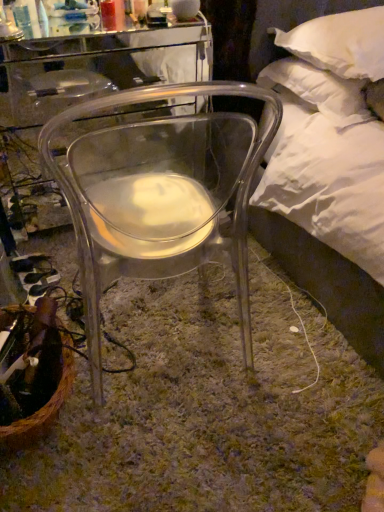
The height and width of the screenshot is (512, 384). What do you see at coordinates (319, 90) in the screenshot?
I see `white soft pillow at upper right, marked as the second pillow in a top-to-bottom arrangement` at bounding box center [319, 90].

Where is `brown woven basket at lower left`? brown woven basket at lower left is located at coordinates (46, 403).

This screenshot has height=512, width=384. What are the coordinates of `transparent plastic chair at center` in the screenshot? It's located at (159, 195).

Consider the image. Is transparent plastic chair at center outside of white soft pillow at upper right, which is the first pillow in bottom-to-top order?

Absolutely, transparent plastic chair at center is external to white soft pillow at upper right, which is the first pillow in bottom-to-top order.

From the image's perspective, is transparent plastic chair at center located above or below white soft pillow at upper right, which is the first pillow in bottom-to-top order?

From the image's perspective, transparent plastic chair at center appears below white soft pillow at upper right, which is the first pillow in bottom-to-top order.

Considering the sizes of objects transparent plastic chair at center and white soft pillow at upper right, which is the first pillow in bottom-to-top order, in the image provided, who is thinner, transparent plastic chair at center or white soft pillow at upper right, which is the first pillow in bottom-to-top order,?

With smaller width is white soft pillow at upper right, which is the first pillow in bottom-to-top order.

In the scene shown: Is transparent plastic chair at center turned away from white soft pillow at upper right, marked as the second pillow in a top-to-bottom arrangement?

No, white soft pillow at upper right, marked as the second pillow in a top-to-bottom arrangement, is not at the back of transparent plastic chair at center.

Can you confirm if white soft pillow at upper right, the first pillow positioned from the top, is positioned to the right of transparent plastic chair at center?

Indeed, white soft pillow at upper right, the first pillow positioned from the top, is positioned on the right side of transparent plastic chair at center.

From the picture: Is white soft pillow at upper right, arranged as the second pillow when ordered from the bottom, in contact with transparent plastic chair at center?

They are not placed beside each other.

Which is behind, point (344, 68) or point (182, 262)?

The point (344, 68) is farther.

Which is correct: white soft pillow at upper right, arranged as the second pillow when ordered from the bottom, is inside transparent plastic chair at center, or outside of it?

white soft pillow at upper right, arranged as the second pillow when ordered from the bottom, is spatially situated outside transparent plastic chair at center.

Which object is closer to the camera, white soft pillow at upper right, which is the first pillow in bottom-to-top order, or brown woven basket at lower left?

brown woven basket at lower left is in front.

Is white soft pillow at upper right, marked as the second pillow in a top-to-bottom arrangement, facing away from brown woven basket at lower left?

That's not correct — white soft pillow at upper right, marked as the second pillow in a top-to-bottom arrangement, is not looking away from brown woven basket at lower left.

Does white soft pillow at upper right, which is the first pillow in bottom-to-top order, touch brown woven basket at lower left?

white soft pillow at upper right, which is the first pillow in bottom-to-top order, and brown woven basket at lower left are clearly separated.

From the image's perspective, which pillow is the 1st one above the brown woven basket at lower left? Please provide its 2D coordinates.

[(319, 90)]

Does point (323, 23) lie behind point (367, 113)?

Yes, point (323, 23) is behind point (367, 113).

Can we say white soft pillow at upper right, arranged as the second pillow when ordered from the bottom, lies outside white soft pillow at upper right, marked as the second pillow in a top-to-bottom arrangement?

Indeed, white soft pillow at upper right, arranged as the second pillow when ordered from the bottom, is completely outside white soft pillow at upper right, marked as the second pillow in a top-to-bottom arrangement.

Is white soft pillow at upper right, arranged as the second pillow when ordered from the bottom, beside white soft pillow at upper right, marked as the second pillow in a top-to-bottom arrangement?

Indeed, white soft pillow at upper right, arranged as the second pillow when ordered from the bottom, and white soft pillow at upper right, marked as the second pillow in a top-to-bottom arrangement, are beside each other and touching.

Does white soft pillow at upper right, which is the first pillow in bottom-to-top order, have a greater height compared to transparent plastic chair at center?

Incorrect, the height of white soft pillow at upper right, which is the first pillow in bottom-to-top order, is not larger of that of transparent plastic chair at center.

Between white soft pillow at upper right, marked as the second pillow in a top-to-bottom arrangement, and transparent plastic chair at center, which one appears on the right side from the viewer's perspective?

Positioned to the right is white soft pillow at upper right, marked as the second pillow in a top-to-bottom arrangement.

Which object is thinner, white soft pillow at upper right, marked as the second pillow in a top-to-bottom arrangement, or transparent plastic chair at center?

white soft pillow at upper right, marked as the second pillow in a top-to-bottom arrangement, is thinner.

Is white soft pillow at upper right, which is the first pillow in bottom-to-top order, facing away from transparent plastic chair at center?

No, white soft pillow at upper right, which is the first pillow in bottom-to-top order, is not facing away from transparent plastic chair at center.

Looking at this image, between transparent plastic chair at center and brown woven basket at lower left, which one has larger size?

transparent plastic chair at center.

What's the angular difference between transparent plastic chair at center and brown woven basket at lower left's facing directions?

transparent plastic chair at center and brown woven basket at lower left are facing 135 degrees away from each other.

Is there a large distance between transparent plastic chair at center and brown woven basket at lower left?

No.

How far apart are transparent plastic chair at center and brown woven basket at lower left?

transparent plastic chair at center and brown woven basket at lower left are 54.68 centimeters apart from each other.

From the image's perspective, who appears lower, white soft pillow at upper right, the first pillow positioned from the top, or brown woven basket at lower left?

brown woven basket at lower left, from the image's perspective.

Is white soft pillow at upper right, arranged as the second pillow when ordered from the bottom, in contact with brown woven basket at lower left?

white soft pillow at upper right, arranged as the second pillow when ordered from the bottom, and brown woven basket at lower left are not in contact.

Between point (275, 42) and point (62, 380), which one is positioned in front?

The point (62, 380) is closer to the camera.

Starting from the transparent plastic chair at center, which pillow is the 2nd one behind? Please provide its 2D coordinates.

[(319, 90)]

At what (x,y) coordinates should I click in order to perform the action: click on chair that is on the left side of white soft pillow at upper right, arranged as the second pillow when ordered from the bottom. Please return your answer as a coordinate pair (x, y). The image size is (384, 512). Looking at the image, I should click on (159, 195).

Estimate the real-world distances between objects in this image. Which object is closer to brown woven basket at lower left, white soft pillow at upper right, which is the first pillow in bottom-to-top order, or white soft pillow at upper right, arranged as the second pillow when ordered from the bottom?

white soft pillow at upper right, which is the first pillow in bottom-to-top order, is closer to brown woven basket at lower left.

Which object lies nearer to the anchor point transparent plastic chair at center, white soft pillow at upper right, arranged as the second pillow when ordered from the bottom, or brown woven basket at lower left?

white soft pillow at upper right, arranged as the second pillow when ordered from the bottom, lies closer to transparent plastic chair at center than the other object.

Based on their spatial positions, is white soft pillow at upper right, arranged as the second pillow when ordered from the bottom, or white soft pillow at upper right, which is the first pillow in bottom-to-top order, closer to brown woven basket at lower left?

white soft pillow at upper right, which is the first pillow in bottom-to-top order, is positioned closer to the anchor brown woven basket at lower left.

Based on their spatial positions, is transparent plastic chair at center or white soft pillow at upper right, marked as the second pillow in a top-to-bottom arrangement, further from white soft pillow at upper right, arranged as the second pillow when ordered from the bottom?

transparent plastic chair at center lies further to white soft pillow at upper right, arranged as the second pillow when ordered from the bottom, than the other object.

Considering their positions, is transparent plastic chair at center positioned further to white soft pillow at upper right, the first pillow positioned from the top, than brown woven basket at lower left?

Among the two, brown woven basket at lower left is located further to white soft pillow at upper right, the first pillow positioned from the top.

Estimate the real-world distances between objects in this image. Which object is further from brown woven basket at lower left, transparent plastic chair at center or white soft pillow at upper right, which is the first pillow in bottom-to-top order?

Among the two, white soft pillow at upper right, which is the first pillow in bottom-to-top order, is located further to brown woven basket at lower left.

Which object lies further to the anchor point white soft pillow at upper right, marked as the second pillow in a top-to-bottom arrangement, brown woven basket at lower left or white soft pillow at upper right, arranged as the second pillow when ordered from the bottom?

Based on the image, brown woven basket at lower left appears to be further to white soft pillow at upper right, marked as the second pillow in a top-to-bottom arrangement.

Estimate the real-world distances between objects in this image. Which object is further from white soft pillow at upper right, marked as the second pillow in a top-to-bottom arrangement, transparent plastic chair at center or brown woven basket at lower left?

brown woven basket at lower left.

You are a GUI agent. You are given a task and a screenshot of the screen. Output one action in this format:
    pyautogui.click(x=<x>, y=<y>)
    Task: Click on the chair located between brown woven basket at lower left and white soft pillow at upper right, arranged as the second pillow when ordered from the bottom, in the left-right direction
    The height and width of the screenshot is (512, 384).
    Given the screenshot: What is the action you would take?
    pyautogui.click(x=159, y=195)

This screenshot has height=512, width=384. I want to click on pillow between transparent plastic chair at center and white soft pillow at upper right, the first pillow positioned from the top, in the horizontal direction, so click(319, 90).

You are a GUI agent. You are given a task and a screenshot of the screen. Output one action in this format:
    pyautogui.click(x=<x>, y=<y>)
    Task: Click on the pillow located between brown woven basket at lower left and white soft pillow at upper right, the first pillow positioned from the top, in the left-right direction
    This screenshot has width=384, height=512.
    Given the screenshot: What is the action you would take?
    pyautogui.click(x=319, y=90)

Image resolution: width=384 pixels, height=512 pixels. I want to click on chair between brown woven basket at lower left and white soft pillow at upper right, which is the first pillow in bottom-to-top order, so click(159, 195).